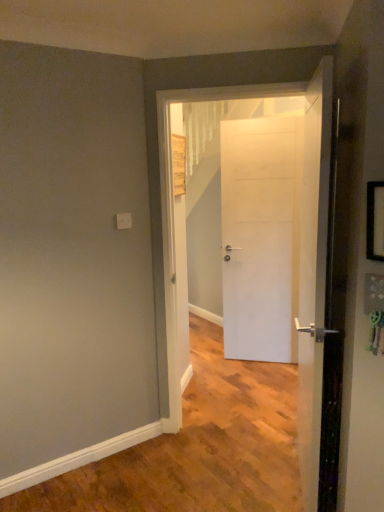
At what (x,y) coordinates should I click in order to perform the action: click on white matte door at center, acting as the 2th door starting from the back. Please return your answer as a coordinate pair (x, y). The image size is (384, 512). Looking at the image, I should click on (170, 172).

What are the coordinates of `white matte door at center, which appears as the first door when viewed from the front` in the screenshot? It's located at (313, 274).

Is point (166, 342) closer to camera compared to point (367, 240)?

No, it is behind (367, 240).

From the image's perspective, is white matte door at center, arranged as the 2th door when viewed from the front, above black plastic picture frame at right?

No, from the image's perspective, white matte door at center, arranged as the 2th door when viewed from the front, is not above black plastic picture frame at right.

Is white matte door at center, acting as the 2th door starting from the back, outside of black plastic picture frame at right?

Yes, white matte door at center, acting as the 2th door starting from the back, is outside of black plastic picture frame at right.

Is white matte door at center, acting as the 2th door starting from the back, oriented towards black plastic picture frame at right?

No.

Is there a large distance between white matte door at center, arranged as the 2th door when viewed from the front, and white matte door at center, positioned as the 3th door in back-to-front order?

No, white matte door at center, arranged as the 2th door when viewed from the front, is not far from white matte door at center, positioned as the 3th door in back-to-front order.

The height and width of the screenshot is (512, 384). What are the coordinates of `the 1st door behind the white matte door at center, which appears as the first door when viewed from the front` in the screenshot? It's located at (170, 172).

Does white matte door at center, arranged as the 2th door when viewed from the front, appear on the left side of white matte door at center, positioned as the 3th door in back-to-front order?

Yes, white matte door at center, arranged as the 2th door when viewed from the front, is to the left of white matte door at center, positioned as the 3th door in back-to-front order.

From a real-world perspective, which object stands above the other?

In real-world perspective, white matte door at center, arranged as the 2th door when viewed from the front, is above.

Is black plastic picture frame at right turned away from white matte door at center, positioned as the 1th door in back-to-front order?

No, black plastic picture frame at right is not facing the opposite direction of white matte door at center, positioned as the 1th door in back-to-front order.

Consider the image. Looking at their sizes, would you say black plastic picture frame at right is wider or thinner than white matte door at center, arranged as the 3th door when viewed from the front?

In the image, black plastic picture frame at right appears to be more narrow than white matte door at center, arranged as the 3th door when viewed from the front.

Considering the relative positions of black plastic picture frame at right and white matte door at center, arranged as the 3th door when viewed from the front, in the image provided, is black plastic picture frame at right to the left or to the right of white matte door at center, arranged as the 3th door when viewed from the front,?

Clearly, black plastic picture frame at right is on the right of white matte door at center, arranged as the 3th door when viewed from the front, in the image.

Can you confirm if black plastic picture frame at right is taller than white matte door at center, positioned as the 1th door in back-to-front order?

Incorrect, the height of black plastic picture frame at right is not larger of that of white matte door at center, positioned as the 1th door in back-to-front order.

How many degrees apart are the facing directions of white matte door at center, arranged as the 3th door when viewed from the front, and black plastic picture frame at right?

The angle between the facing direction of white matte door at center, arranged as the 3th door when viewed from the front, and the facing direction of black plastic picture frame at right is 45.2 degrees.

Is point (281, 179) closer or farther from the camera than point (371, 259)?

Clearly, point (281, 179) is more distant from the camera than point (371, 259).

Which of these two, white matte door at center, positioned as the 1th door in back-to-front order, or black plastic picture frame at right, is smaller?

Smaller between the two is black plastic picture frame at right.

From the picture: Is white matte door at center, arranged as the 3th door when viewed from the front, to the right of black plastic picture frame at right from the viewer's perspective?

Incorrect, white matte door at center, arranged as the 3th door when viewed from the front, is not on the right side of black plastic picture frame at right.

Is white matte door at center, arranged as the 2th door when viewed from the front, taller or shorter than white matte door at center, arranged as the 3th door when viewed from the front?

white matte door at center, arranged as the 2th door when viewed from the front, is taller than white matte door at center, arranged as the 3th door when viewed from the front.

Which object is further away from the camera taking this photo, white matte door at center, arranged as the 2th door when viewed from the front, or white matte door at center, positioned as the 1th door in back-to-front order?

white matte door at center, positioned as the 1th door in back-to-front order, is further away from the camera.

How distant is white matte door at center, arranged as the 2th door when viewed from the front, from white matte door at center, arranged as the 3th door when viewed from the front?

white matte door at center, arranged as the 2th door when viewed from the front, and white matte door at center, arranged as the 3th door when viewed from the front, are 3.75 feet apart from each other.

Between white matte door at center, acting as the 2th door starting from the back, and white matte door at center, arranged as the 3th door when viewed from the front, which one appears on the right side from the viewer's perspective?

white matte door at center, arranged as the 3th door when viewed from the front, is more to the right.

Is black plastic picture frame at right smaller than white matte door at center, acting as the 2th door starting from the back?

Correct, black plastic picture frame at right occupies less space than white matte door at center, acting as the 2th door starting from the back.

Is black plastic picture frame at right at the right side of white matte door at center, arranged as the 2th door when viewed from the front?

Correct, you'll find black plastic picture frame at right to the right of white matte door at center, arranged as the 2th door when viewed from the front.

Is white matte door at center, arranged as the 2th door when viewed from the front, at the back of black plastic picture frame at right?

No, black plastic picture frame at right is not facing away from white matte door at center, arranged as the 2th door when viewed from the front.

Based on their positions, is white matte door at center, positioned as the 3th door in back-to-front order, located to the left or right of white matte door at center, arranged as the 3th door when viewed from the front?

From the image, it's evident that white matte door at center, positioned as the 3th door in back-to-front order, is to the left of white matte door at center, arranged as the 3th door when viewed from the front.

From their relative heights in the image, would you say white matte door at center, positioned as the 3th door in back-to-front order, is taller or shorter than white matte door at center, positioned as the 1th door in back-to-front order?

Clearly, white matte door at center, positioned as the 3th door in back-to-front order, is taller compared to white matte door at center, positioned as the 1th door in back-to-front order.

Is white matte door at center, which appears as the first door when viewed from the front, oriented away from white matte door at center, positioned as the 1th door in back-to-front order?

No, white matte door at center, which appears as the first door when viewed from the front, is not facing the opposite direction of white matte door at center, positioned as the 1th door in back-to-front order.

Are white matte door at center, which appears as the first door when viewed from the front, and white matte door at center, positioned as the 1th door in back-to-front order, located far from each other?

white matte door at center, which appears as the first door when viewed from the front, is far away from white matte door at center, positioned as the 1th door in back-to-front order.

This screenshot has width=384, height=512. I want to click on door that is the 3rd one when counting leftward from the black plastic picture frame at right, so click(170, 172).

Starting from the white matte door at center, which appears as the first door when viewed from the front, which door is the 1st one behind? Please provide its 2D coordinates.

[(170, 172)]

From the image, which object appears to be farther from white matte door at center, positioned as the 3th door in back-to-front order, white matte door at center, arranged as the 3th door when viewed from the front, or black plastic picture frame at right?

white matte door at center, arranged as the 3th door when viewed from the front, is further to white matte door at center, positioned as the 3th door in back-to-front order.

Estimate the real-world distances between objects in this image. Which object is further from black plastic picture frame at right, white matte door at center, positioned as the 3th door in back-to-front order, or white matte door at center, positioned as the 1th door in back-to-front order?

white matte door at center, positioned as the 1th door in back-to-front order, is positioned further to the anchor black plastic picture frame at right.

Based on the photo, which object lies further to the anchor point white matte door at center, arranged as the 2th door when viewed from the front, white matte door at center, which appears as the first door when viewed from the front, or black plastic picture frame at right?

The object further to white matte door at center, arranged as the 2th door when viewed from the front, is black plastic picture frame at right.

In the scene shown: From the image, which object appears to be nearer to white matte door at center, positioned as the 3th door in back-to-front order, black plastic picture frame at right or white matte door at center, positioned as the 1th door in back-to-front order?

The object closer to white matte door at center, positioned as the 3th door in back-to-front order, is black plastic picture frame at right.

Considering their positions, is white matte door at center, which appears as the first door when viewed from the front, positioned closer to white matte door at center, positioned as the 1th door in back-to-front order, than white matte door at center, arranged as the 2th door when viewed from the front?

Based on the image, white matte door at center, arranged as the 2th door when viewed from the front, appears to be nearer to white matte door at center, positioned as the 1th door in back-to-front order.

Based on their spatial positions, is white matte door at center, positioned as the 1th door in back-to-front order, or white matte door at center, positioned as the 3th door in back-to-front order, further from white matte door at center, arranged as the 2th door when viewed from the front?

Based on the image, white matte door at center, positioned as the 1th door in back-to-front order, appears to be further to white matte door at center, arranged as the 2th door when viewed from the front.

Based on their spatial positions, is white matte door at center, positioned as the 1th door in back-to-front order, or white matte door at center, which appears as the first door when viewed from the front, further from black plastic picture frame at right?

white matte door at center, positioned as the 1th door in back-to-front order.

Looking at the image, which one is located closer to white matte door at center, acting as the 2th door starting from the back, white matte door at center, which appears as the first door when viewed from the front, or white matte door at center, arranged as the 3th door when viewed from the front?

The object closer to white matte door at center, acting as the 2th door starting from the back, is white matte door at center, which appears as the first door when viewed from the front.

Find the location of a particular element. This screenshot has width=384, height=512. door between white matte door at center, which appears as the first door when viewed from the front, and white matte door at center, positioned as the 1th door in back-to-front order, along the z-axis is located at coordinates (170, 172).

Locate an element on the screen. door between black plastic picture frame at right and white matte door at center, acting as the 2th door starting from the back, along the z-axis is located at coordinates (313, 274).